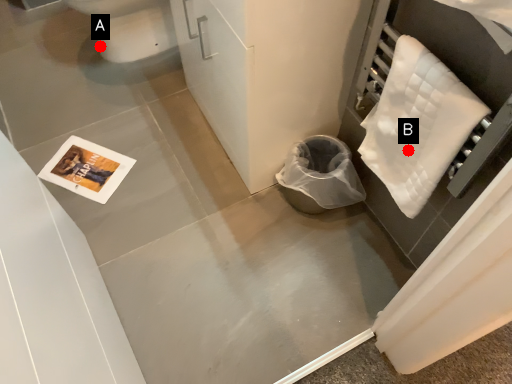
Question: Two points are circled on the image, labeled by A and B beside each circle. Which point is further to the camera?

Choices:
 (A) A is further
 (B) B is further

Answer: (A)